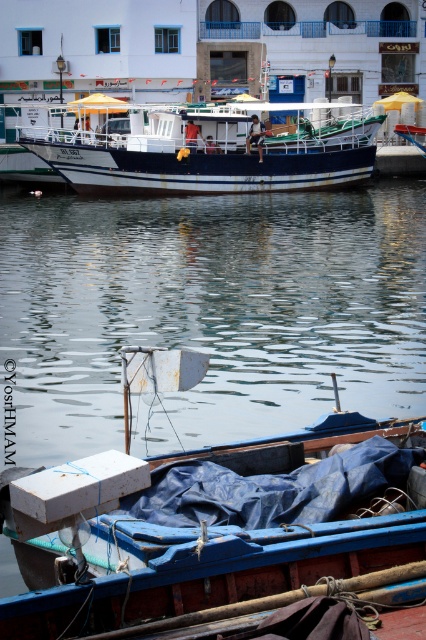
Question: Which of the following is the closest to the observer?

Choices:
 (A) blue tarpaulin boat at lower center
 (B) white glossy boat at center
 (C) clear water at center

Answer: (A)

Question: Can you confirm if blue tarpaulin boat at lower center is positioned below white glossy boat at center?

Choices:
 (A) yes
 (B) no

Answer: (A)

Question: Among these points, which one is farthest from the camera?

Choices:
 (A) (232, 554)
 (B) (310, 102)
 (C) (328, 321)

Answer: (B)

Question: Which object is farther from the camera taking this photo?

Choices:
 (A) white glossy boat at center
 (B) clear water at center

Answer: (A)

Question: Does blue tarpaulin boat at lower center appear on the left side of white glossy boat at center?

Choices:
 (A) no
 (B) yes

Answer: (B)

Question: Is clear water at center to the right of blue tarpaulin boat at lower center from the viewer's perspective?

Choices:
 (A) yes
 (B) no

Answer: (B)